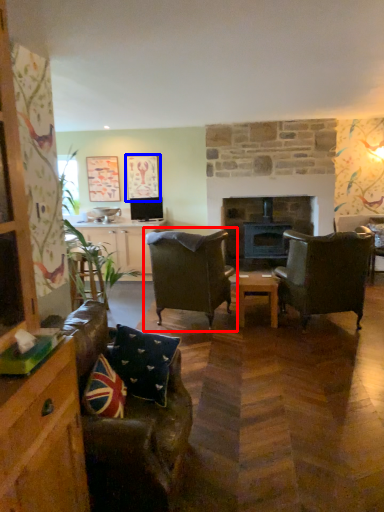
Question: Which object appears farthest to the camera in this image, chair (highlighted by a red box) or picture frame (highlighted by a blue box)?

Choices:
 (A) chair
 (B) picture frame

Answer: (B)